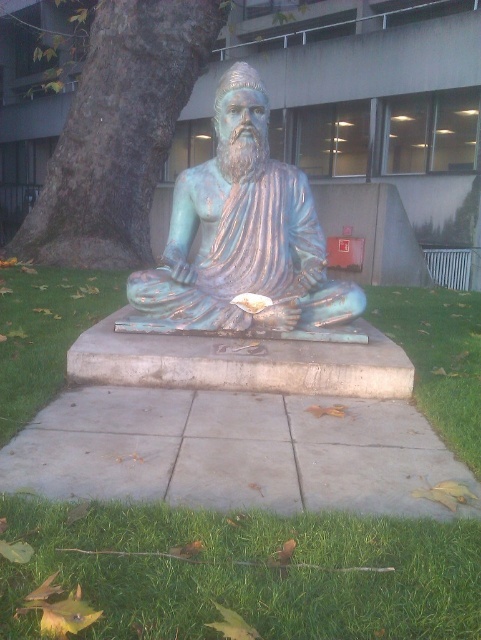
You are a gardener planning to place a new decorative rock in the scene. The rock needs to fit within the space occupied by either the green rough bark at left or the green grass at lower right. Based on their widths, which area can accommodate a wider object?

The green rough bark at left might be wider than green grass at lower right, so it can accommodate a wider object.

From the picture: You are standing in the serene outdoor setting and want to take a photo of the green patina statue at center. To ensure the green grass at lower center is visible in the background, should you position yourself in front of or behind the statue?

You should position yourself in front of the green patina statue at center because the green grass at lower center is in front of the statue, meaning the statue will be between you and the grass. To have the grass in the background behind the statue, you need to be in front.